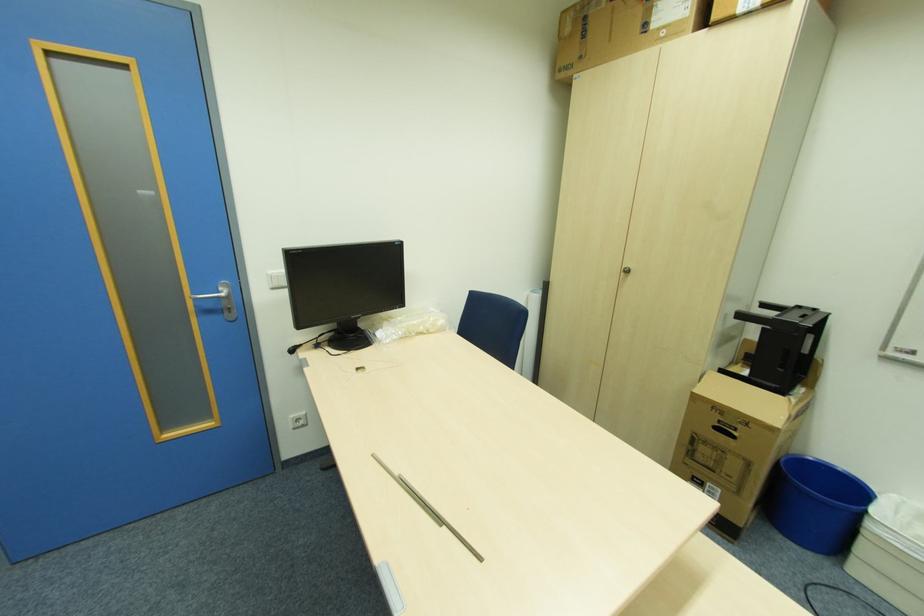
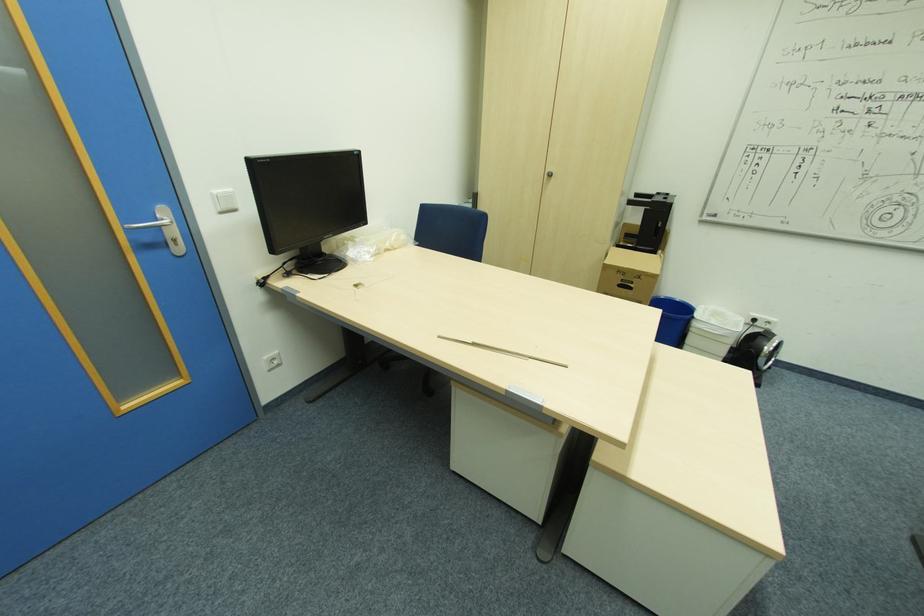
In the second image, find the point that corresponds to point (273, 270) in the first image.

(216, 191)